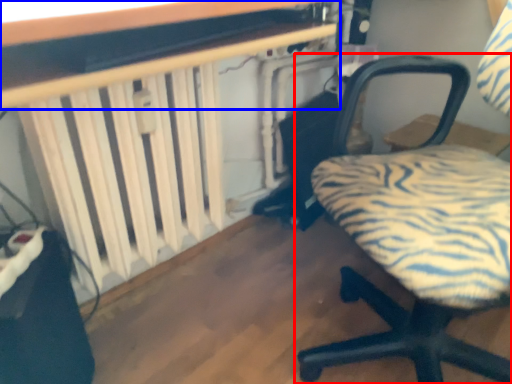
Question: Which object appears farthest to the camera in this image, chair (highlighted by a red box) or table (highlighted by a blue box)?

Choices:
 (A) chair
 (B) table

Answer: (B)